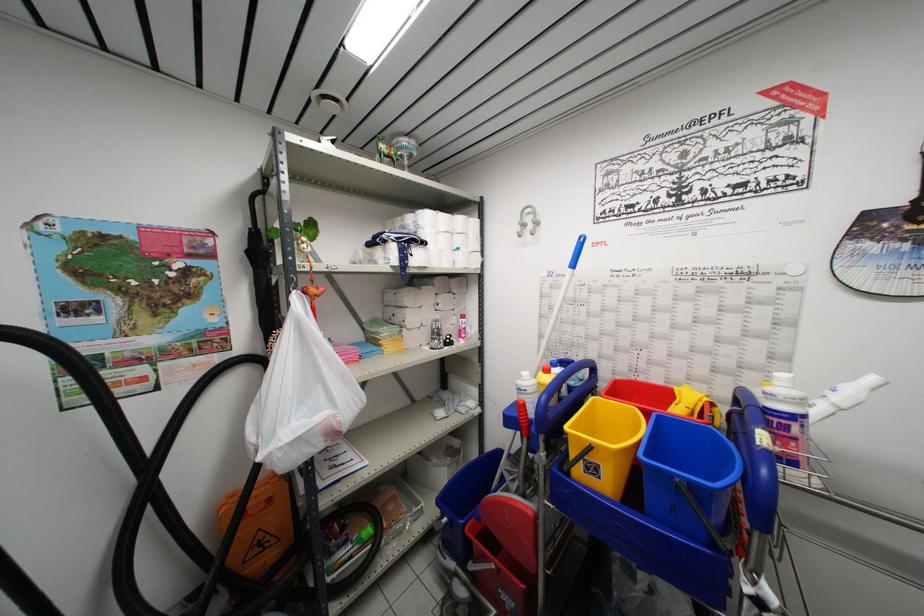
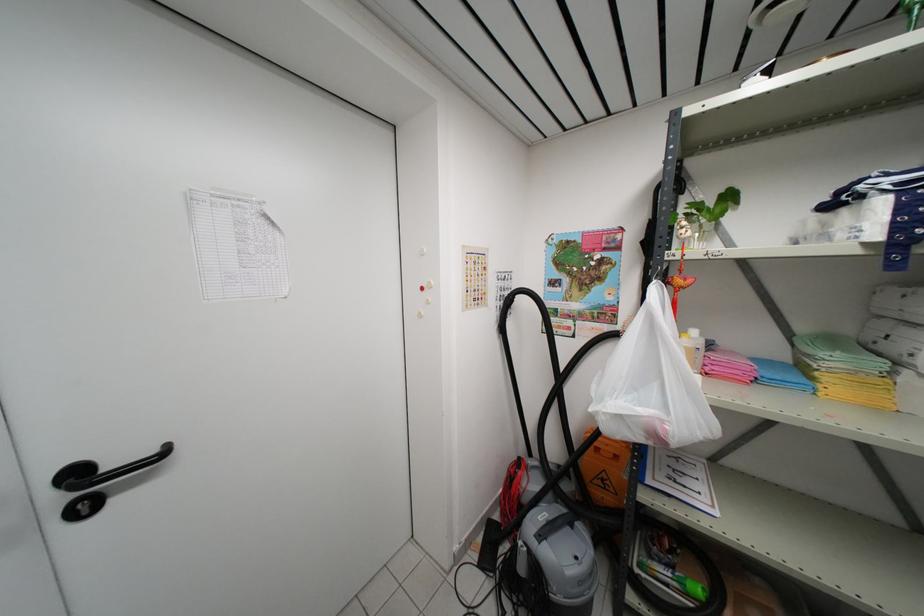
Where in the second image is the point corresponding to point 327,341 from the first image?

(704, 339)